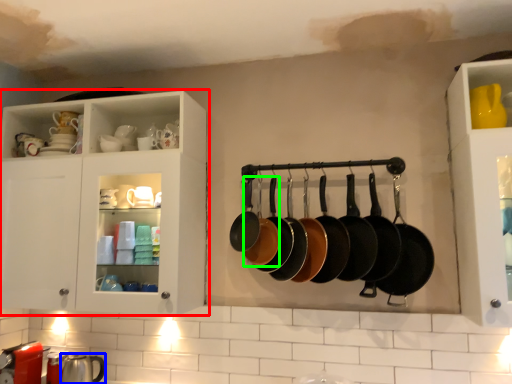
Question: Which is farther away from cabinetry (highlighted by a red box)? tableware (highlighted by a blue box) or frying pan (highlighted by a green box)?

Choices:
 (A) tableware
 (B) frying pan

Answer: (A)